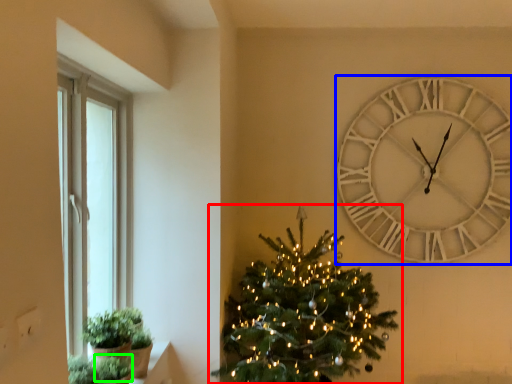
Question: Which object is the farthest from christmas tree (highlighted by a red box)? Choose among these: wall clock (highlighted by a blue box) or plant (highlighted by a green box).

Choices:
 (A) wall clock
 (B) plant

Answer: (B)